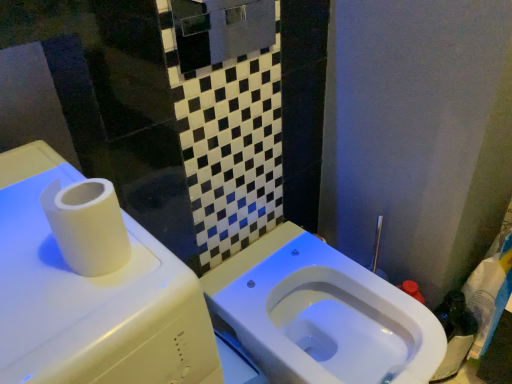
Question: From the image's perspective, is white matte water tank at upper left located above or below white glossy toilet at center?

Choices:
 (A) above
 (B) below

Answer: (A)

Question: Relative to white glossy toilet at center, is white matte water tank at upper left in front or behind?

Choices:
 (A) front
 (B) behind

Answer: (A)

Question: Is white matte water tank at upper left taller or shorter than white glossy toilet at center?

Choices:
 (A) short
 (B) tall

Answer: (B)

Question: Is point (437, 357) closer or farther from the camera than point (164, 380)?

Choices:
 (A) farther
 (B) closer

Answer: (A)

Question: From their relative heights in the image, would you say white glossy toilet at center is taller or shorter than white matte water tank at upper left?

Choices:
 (A) short
 (B) tall

Answer: (A)

Question: Considering their positions, is white glossy toilet at center located in front of or behind white matte water tank at upper left?

Choices:
 (A) front
 (B) behind

Answer: (B)

Question: In terms of width, does white glossy toilet at center look wider or thinner when compared to white matte water tank at upper left?

Choices:
 (A) thin
 (B) wide

Answer: (A)